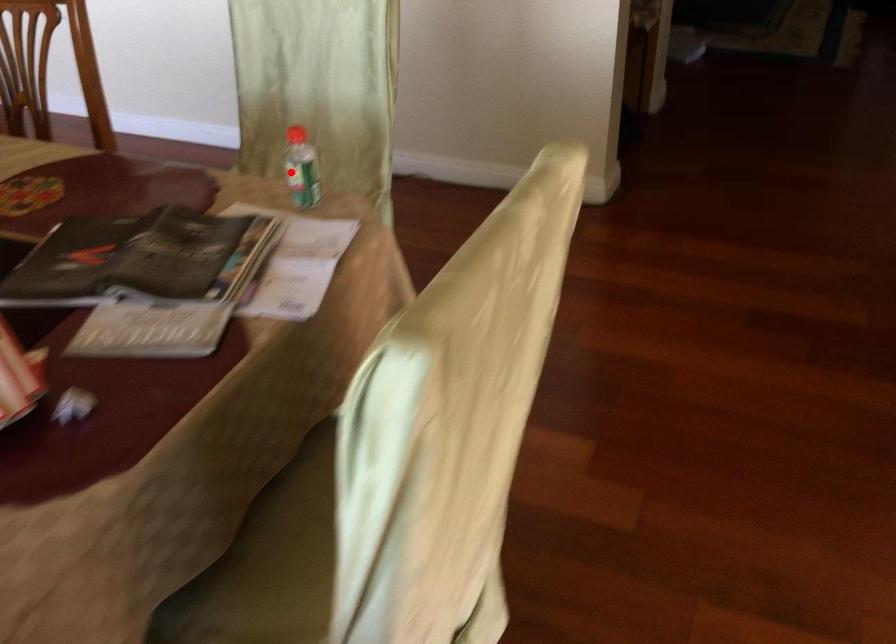
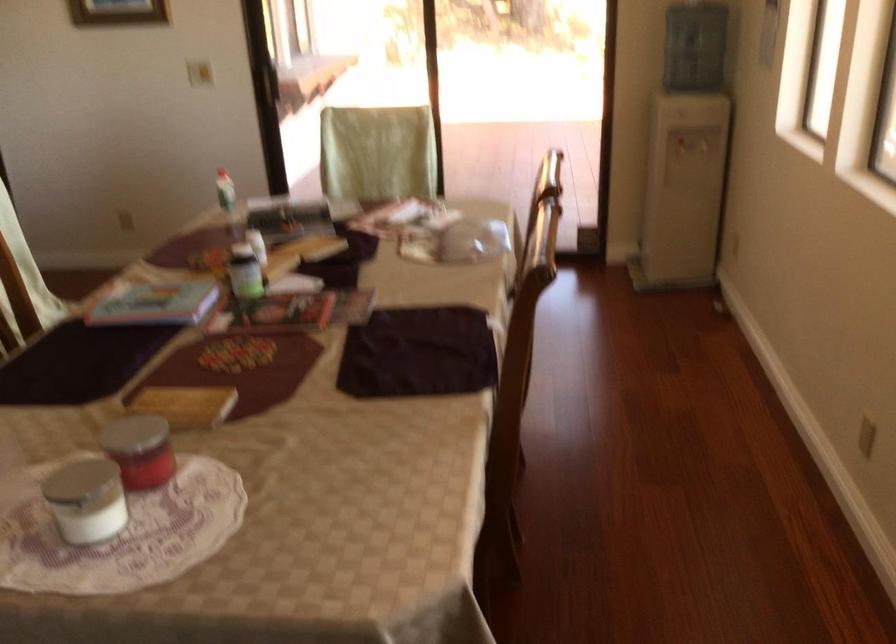
Question: I am providing you with two images of the same scene from different viewpoints. In image1, a red point is highlighted. Considering the same 3D point in image2, which of the following is correct?

Choices:
 (A) It is closer
 (B) It is farther

Answer: (B)